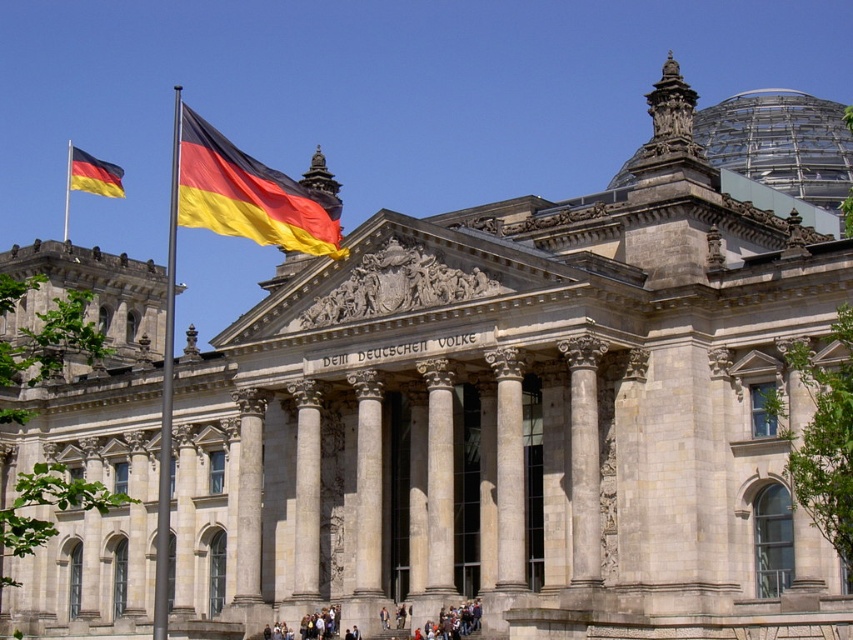
Question: Does yellow-red-black fabric flag at center have a larger size compared to polished silver flag pole at center?

Choices:
 (A) yes
 (B) no

Answer: (B)

Question: Considering the relative positions of yellow-red-black fabric flag at center and matte yellow and black flag at upper left in the image provided, where is yellow-red-black fabric flag at center located with respect to matte yellow and black flag at upper left?

Choices:
 (A) left
 (B) right

Answer: (B)

Question: Which object is closer to the camera taking this photo?

Choices:
 (A) yellow-red-black fabric flag at center
 (B) matte yellow and black flag at upper left

Answer: (A)

Question: Does yellow-red-black fabric flag at center appear under matte yellow and black flag at upper left?

Choices:
 (A) yes
 (B) no

Answer: (A)

Question: Among these points, which one is nearest to the camera?

Choices:
 (A) (277, 170)
 (B) (155, 556)

Answer: (B)

Question: Which object is positioned closest to the polished silver flag pole at center?

Choices:
 (A) yellow-red-black fabric flag at center
 (B) matte yellow and black flag at upper left
 (C) metallic flag pole at left

Answer: (B)